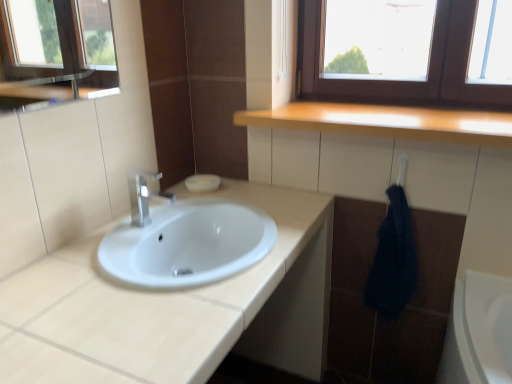
Question: Is dark blue textured towel at right looking in the opposite direction of light wood countertop at upper center?

Choices:
 (A) yes
 (B) no

Answer: (B)

Question: Is dark blue textured towel at right wider than light wood countertop at upper center?

Choices:
 (A) yes
 (B) no

Answer: (B)

Question: Does dark blue textured towel at right have a smaller size compared to light wood countertop at upper center?

Choices:
 (A) no
 (B) yes

Answer: (B)

Question: From the image's perspective, would you say dark blue textured towel at right is shown under light wood countertop at upper center?

Choices:
 (A) no
 (B) yes

Answer: (B)

Question: Does dark blue textured towel at right turn towards light wood countertop at upper center?

Choices:
 (A) no
 (B) yes

Answer: (A)

Question: From the image's perspective, relative to satin nickel faucet at center, is dark blue textured towel at right above or below?

Choices:
 (A) above
 (B) below

Answer: (B)

Question: Considering the positions of dark blue textured towel at right and satin nickel faucet at center in the image, is dark blue textured towel at right wider or thinner than satin nickel faucet at center?

Choices:
 (A) wide
 (B) thin

Answer: (B)

Question: In terms of height, does dark blue textured towel at right look taller or shorter compared to satin nickel faucet at center?

Choices:
 (A) short
 (B) tall

Answer: (B)

Question: Is point (394, 299) positioned closer to the camera than point (157, 175)?

Choices:
 (A) closer
 (B) farther

Answer: (A)

Question: Is point (104, 337) positioned closer to the camera than point (411, 129)?

Choices:
 (A) farther
 (B) closer

Answer: (B)

Question: Looking at the image, does white glossy sink at center seem bigger or smaller compared to light wood countertop at upper center?

Choices:
 (A) big
 (B) small

Answer: (A)

Question: From a real-world perspective, relative to light wood countertop at upper center, is white glossy sink at center vertically above or below?

Choices:
 (A) above
 (B) below

Answer: (B)

Question: Which is correct: white glossy sink at center is inside light wood countertop at upper center, or outside of it?

Choices:
 (A) inside
 (B) outside

Answer: (B)

Question: From a real-world perspective, is light wood countertop at upper center above or below satin nickel faucet at center?

Choices:
 (A) below
 (B) above

Answer: (B)

Question: Is light wood countertop at upper center taller or shorter than satin nickel faucet at center?

Choices:
 (A) short
 (B) tall

Answer: (A)